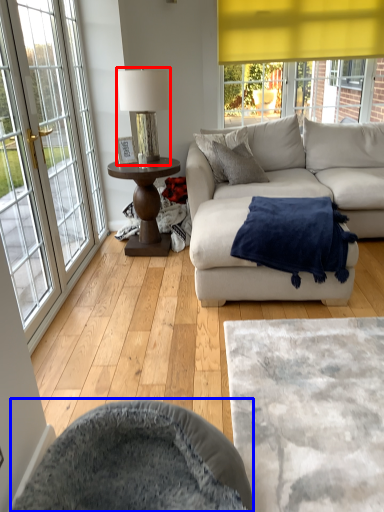
Question: Which object is closer to the camera taking this photo, table lamp (highlighted by a red box) or swivel chair (highlighted by a blue box)?

Choices:
 (A) table lamp
 (B) swivel chair

Answer: (B)